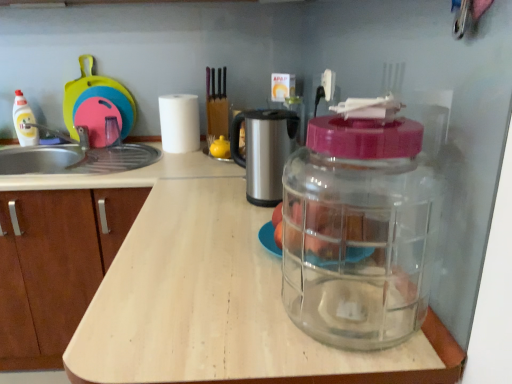
The height and width of the screenshot is (384, 512). In order to click on vacant space in between stainless steel coffee maker at center and white plastic bottle at left, placed as the 1th bottle when sorted from back to front in this screenshot , I will do `click(166, 174)`.